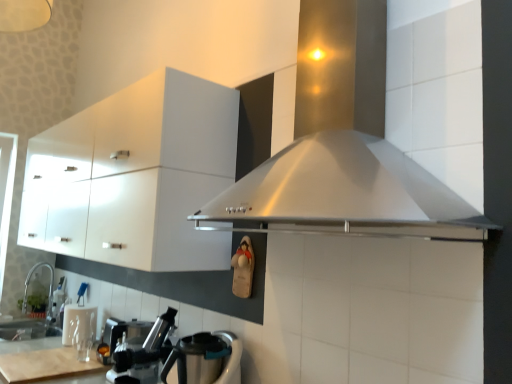
Question: Is metallic silver coffee machine at lower left to the left of stainless steel kettle at lower left from the viewer's perspective?

Choices:
 (A) no
 (B) yes

Answer: (B)

Question: Can you confirm if metallic silver coffee machine at lower left is smaller than stainless steel kettle at lower left?

Choices:
 (A) no
 (B) yes

Answer: (B)

Question: Considering the relative sizes of metallic silver coffee machine at lower left and stainless steel kettle at lower left in the image provided, is metallic silver coffee machine at lower left bigger than stainless steel kettle at lower left?

Choices:
 (A) no
 (B) yes

Answer: (A)

Question: Would you say metallic silver coffee machine at lower left is outside stainless steel kettle at lower left?

Choices:
 (A) no
 (B) yes

Answer: (B)

Question: Does metallic silver coffee machine at lower left lie in front of stainless steel kettle at lower left?

Choices:
 (A) no
 (B) yes

Answer: (A)

Question: From their relative heights in the image, would you say metallic silver coffee machine at lower left is taller or shorter than white glossy cabinet at upper left?

Choices:
 (A) short
 (B) tall

Answer: (A)

Question: From a real-world perspective, relative to white glossy cabinet at upper left, is metallic silver coffee machine at lower left vertically above or below?

Choices:
 (A) below
 (B) above

Answer: (A)

Question: Is metallic silver coffee machine at lower left to the left or to the right of white glossy cabinet at upper left in the image?

Choices:
 (A) left
 (B) right

Answer: (B)

Question: Considering the positions of metallic silver coffee machine at lower left and white glossy cabinet at upper left in the image, is metallic silver coffee machine at lower left bigger or smaller than white glossy cabinet at upper left?

Choices:
 (A) big
 (B) small

Answer: (B)

Question: Considering the positions of white glossy cabinet at upper left and stainless steel kettle at lower left in the image, is white glossy cabinet at upper left bigger or smaller than stainless steel kettle at lower left?

Choices:
 (A) big
 (B) small

Answer: (A)

Question: From a real-world perspective, is white glossy cabinet at upper left physically located above or below stainless steel kettle at lower left?

Choices:
 (A) below
 (B) above

Answer: (B)

Question: Visually, is white glossy cabinet at upper left positioned to the left or to the right of stainless steel kettle at lower left?

Choices:
 (A) left
 (B) right

Answer: (A)

Question: Considering the positions of white glossy cabinet at upper left and stainless steel kettle at lower left in the image, is white glossy cabinet at upper left taller or shorter than stainless steel kettle at lower left?

Choices:
 (A) tall
 (B) short

Answer: (A)

Question: Considering the positions of point (91, 370) and point (156, 336), is point (91, 370) closer or farther from the camera than point (156, 336)?

Choices:
 (A) farther
 (B) closer

Answer: (A)

Question: Considering the relative positions of wooden cutting board at lower left and metallic silver coffee machine at lower left in the image provided, is wooden cutting board at lower left to the left or to the right of metallic silver coffee machine at lower left?

Choices:
 (A) left
 (B) right

Answer: (A)